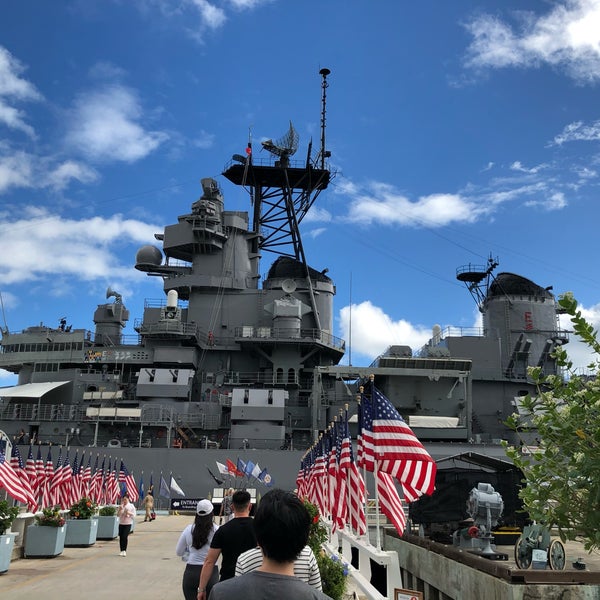
What are the coordinates of `planters` in the screenshot? It's located at (8, 555), (41, 548), (83, 534), (104, 527).